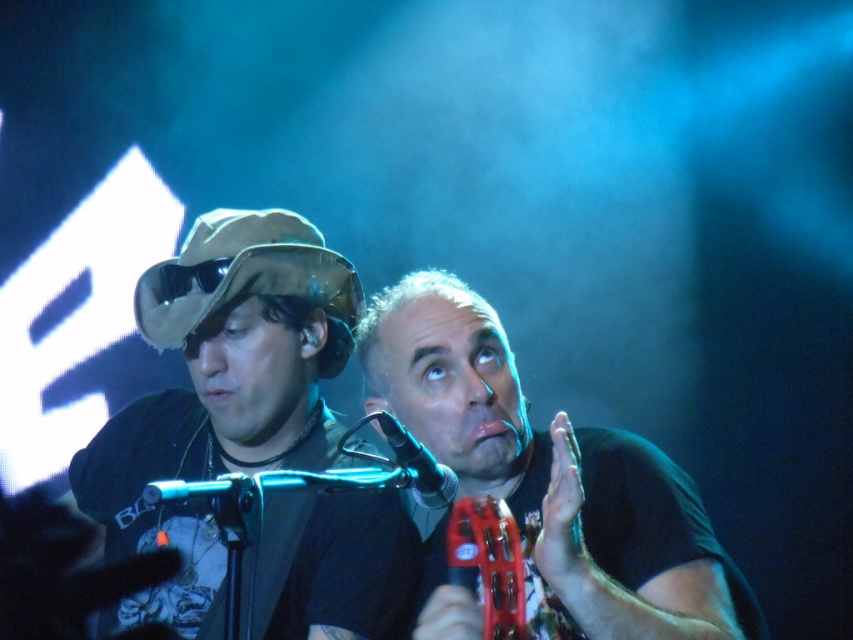
You are a photographer standing at the back of the venue. You want to take a photo of the matte brown hat at left and the matte black tambourine at center so that both are clearly visible in the frame. Given the distance between them, is it possible to capture both objects in a single shot without zooming in?

The distance between the matte brown hat at left and the matte black tambourine at center is 9.37 inches. Since this distance is relatively small, it should be possible to capture both objects in a single shot without zooming in, ensuring both are clearly visible in the frame.

You are at a concert and want to take a photo of the performer with both the matte brown hat at left and the matte black tambourine at center in the frame. Which object should you position closer to the camera to ensure both are fully visible?

The matte brown hat at left is taller than the matte black tambourine at center, so you should position the matte brown hat at left closer to the camera to ensure both objects are fully visible in the photo.